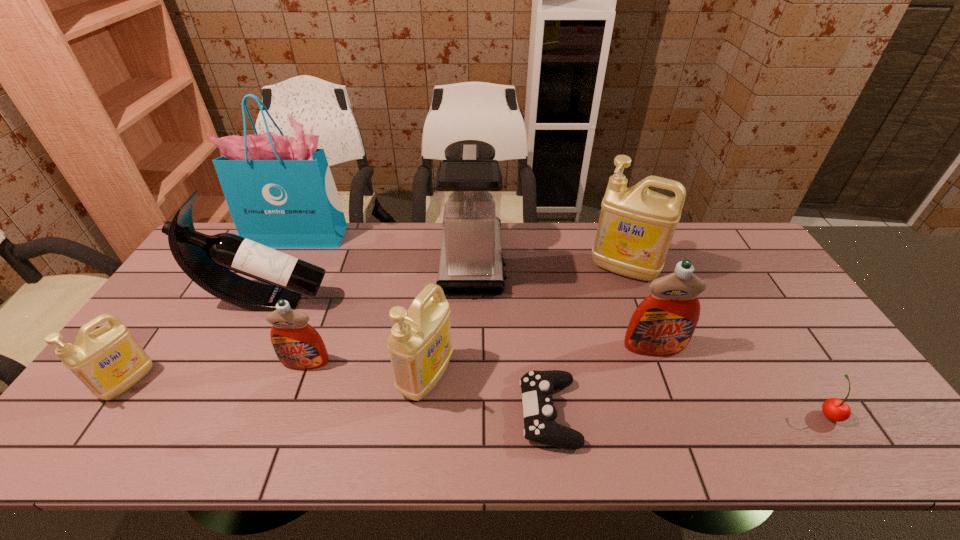
This screenshot has height=540, width=960. I want to click on the smallest beige detergent, so click(109, 360).

Locate an element on the screen. This screenshot has width=960, height=540. the left red detergent is located at coordinates (298, 345).

Where is `the second detergent from left to right`? Image resolution: width=960 pixels, height=540 pixels. the second detergent from left to right is located at coordinates (298, 345).

At what (x,y) coordinates should I click in order to perform the action: click on red cherry. Please return your answer as a coordinate pair (x, y). The width and height of the screenshot is (960, 540). Looking at the image, I should click on (834, 409).

The height and width of the screenshot is (540, 960). Find the location of `the rightmost object`. the rightmost object is located at coordinates (834, 409).

Locate an element on the screen. Image resolution: width=960 pixels, height=540 pixels. the fourth object from right to left is located at coordinates (537, 387).

Locate an element on the screen. control is located at coordinates (537, 387).

At what (x,y) coordinates should I click in order to perform the action: click on vacant space positioned 0.120m on the front of the tallest object. Please return your answer as a coordinate pair (x, y). Looking at the image, I should click on pyautogui.click(x=281, y=272).

At what (x,y) coordinates should I click in order to perform the action: click on free space located 0.290m at the front of the coffee maker where the controls are located. Please return your answer as a coordinate pair (x, y). Looking at the image, I should click on (592, 261).

This screenshot has width=960, height=540. I want to click on free location located on the right of the tallest detergent, so click(x=744, y=269).